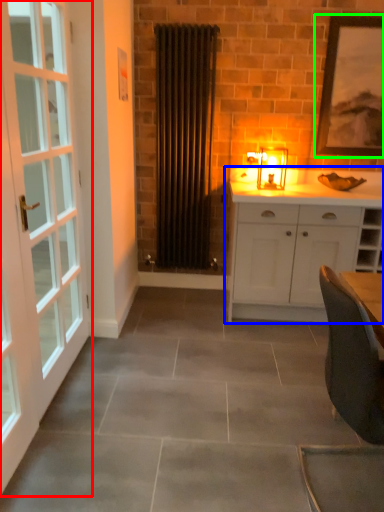
Question: Which object is positioned farthest from door (highlighted by a red box)? Select from cabinetry (highlighted by a blue box) and picture frame (highlighted by a green box).

Choices:
 (A) cabinetry
 (B) picture frame

Answer: (B)